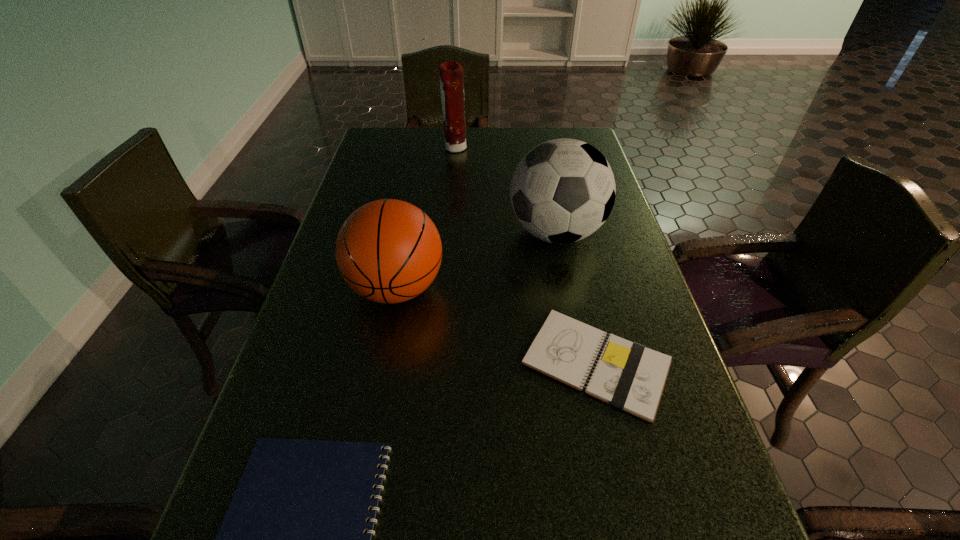
The image size is (960, 540). Find the location of `free space between the soccer ball and the basketball`. free space between the soccer ball and the basketball is located at coordinates (476, 260).

The image size is (960, 540). Identify the location of blank region between the soccer ball and the right notepad. (576, 298).

Where is `vacant space in between the basketball and the farther notepad`? The width and height of the screenshot is (960, 540). vacant space in between the basketball and the farther notepad is located at coordinates (496, 325).

At what (x,y) coordinates should I click in order to perform the action: click on unoccupied position between the taller notepad and the soccer ball. Please return your answer as a coordinate pair (x, y). Looking at the image, I should click on click(576, 298).

This screenshot has height=540, width=960. In order to click on the fourth closest object relative to the soccer ball in this screenshot , I will do `click(292, 539)`.

Identify which object is located as the third nearest to the basketball. Please provide its 2D coordinates. Your answer should be formatted as a tuple, i.e. [(x, y)], where the tuple contains the x and y coordinates of a point satisfying the conditions above.

[(292, 539)]

You are a GUI agent. You are given a task and a screenshot of the screen. Output one action in this format:
    pyautogui.click(x=<x>, y=<y>)
    Task: Click on the free space in the image that satisfies the following two spatial constraints: 1. on the back side of the condiment; 2. on the right side of the basketball
    The image size is (960, 540).
    Given the screenshot: What is the action you would take?
    pyautogui.click(x=423, y=148)